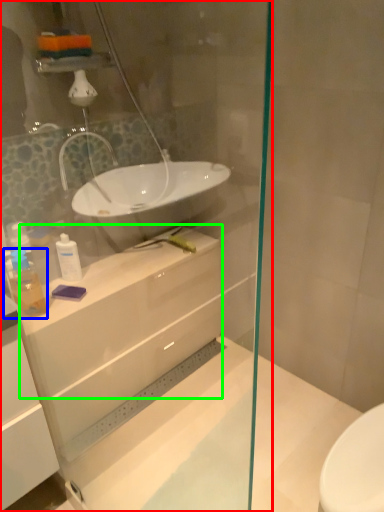
Question: Estimate the real-world distances between objects in this image. Which object is farther from shower door (highlighted by a red box), toiletry (highlighted by a blue box) or counter top (highlighted by a green box)?

Choices:
 (A) toiletry
 (B) counter top

Answer: (A)